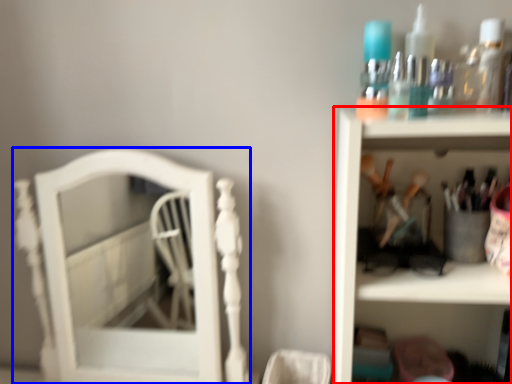
Question: Among these objects, which one is farthest to the camera, shelf (highlighted by a red box) or furniture (highlighted by a blue box)?

Choices:
 (A) shelf
 (B) furniture

Answer: (B)